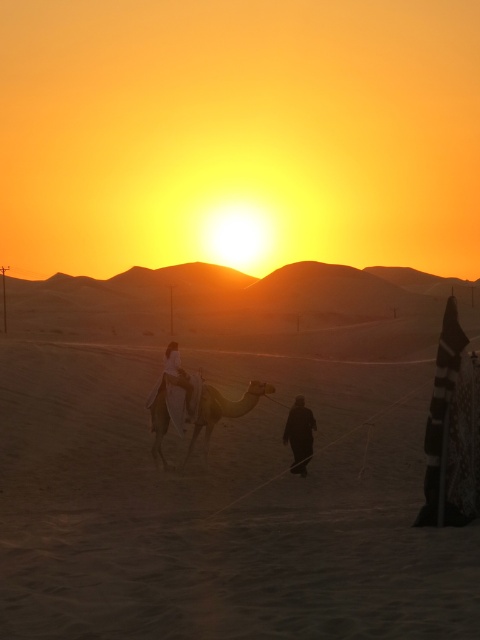
Question: Is sandy beige sand at center in front of white fabric person at center?

Choices:
 (A) yes
 (B) no

Answer: (A)

Question: Is brown textured camel at center wider than white fabric person at center?

Choices:
 (A) yes
 (B) no

Answer: (A)

Question: Can you confirm if brown textured camel at center is positioned to the right of white fabric person at center?

Choices:
 (A) yes
 (B) no

Answer: (A)

Question: Among these points, which one is farthest from the camera?

Choices:
 (A) click(x=75, y=609)
 (B) click(x=298, y=408)

Answer: (B)

Question: Among these points, which one is farthest from the camera?

Choices:
 (A) (266, 394)
 (B) (300, 442)

Answer: (A)

Question: Which object appears farthest from the camera in this image?

Choices:
 (A) sandy beige sand at center
 (B) white fabric person at center
 (C) dark matte person at center

Answer: (B)